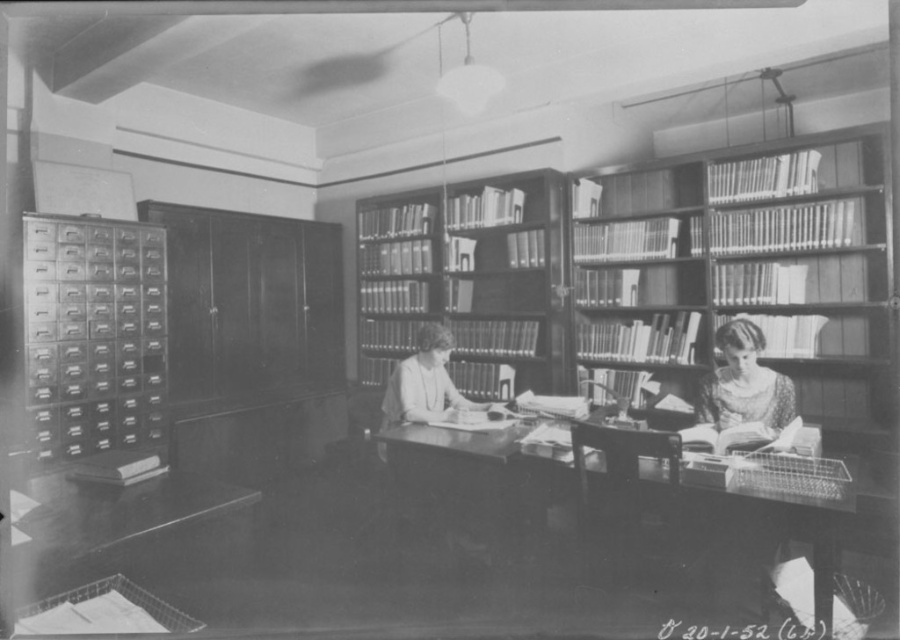
You are a visitor in this historical library and want to place a book on the wooden desk at center. However, you notice the wooden bookcase at center is nearby. Which object is closer to you so you can place the book there first?

The wooden desk at center is closer to the viewer than the wooden bookcase at center, so you can place the book on the wooden desk at center first.

You are a visitor in this historical library and need to place a small decorative item on the wooden desk at center and the wooden bookcase at center. Which surface can accommodate the item if the item requires a taller surface?

The wooden bookcase at center has a greater height than the wooden desk at center, so the item should be placed on the wooden bookcase at center.